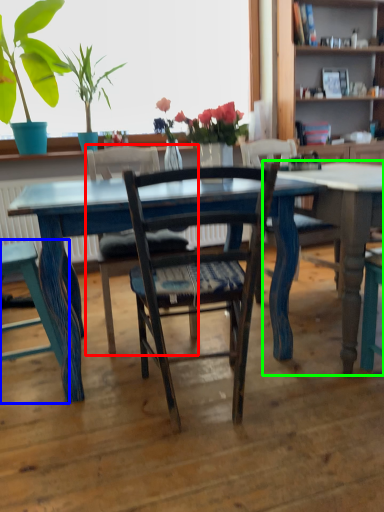
Question: Estimate the real-world distances between objects in this image. Which object is farther from chair (highlighted by a red box), chair (highlighted by a blue box) or table (highlighted by a green box)?

Choices:
 (A) chair
 (B) table

Answer: (B)